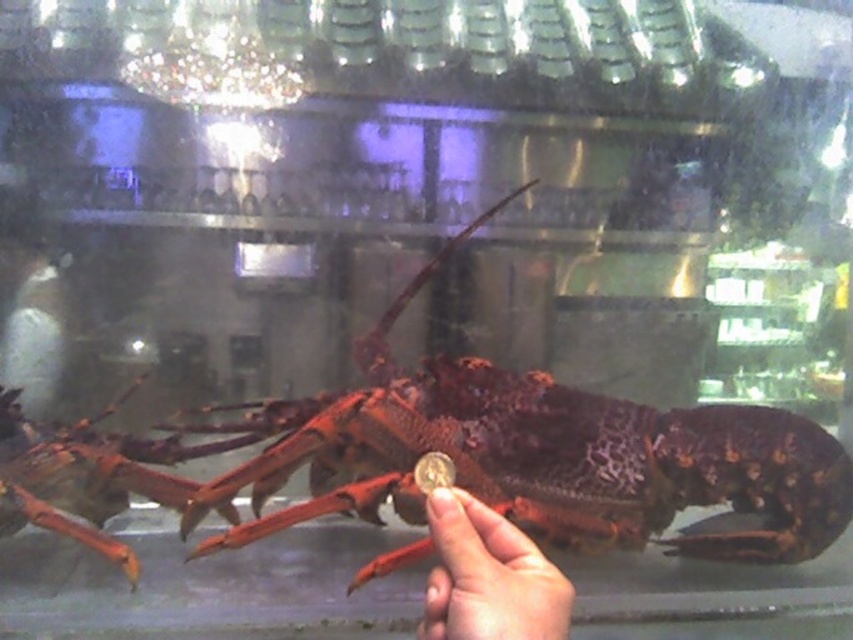
You are a chef preparing to cook a lobster and need to determine if it will fit in a pot that can hold up to the size of a smooth skin hand at center. Based on the scene, will the shiny brown lobster at center fit in the pot?

The shiny brown lobster at center is larger than the smooth skin hand at center. Since the pot can only hold up to the size of the smooth skin hand at center, the lobster will not fit in the pot.

What are the coordinates of the shiny brown lobster at center?

The shiny brown lobster at center is located at point (537, 454).

You are a chef preparing to cook a lobster and need to know the distance between the shiny brown lobster at center and the shiny metallic claw at center in the tank. Is the distance more than a foot?

The shiny brown lobster at center is 12.16 inches away from the shiny metallic claw at center. Since 12 inches equals 1 foot, the distance is slightly more than a foot.